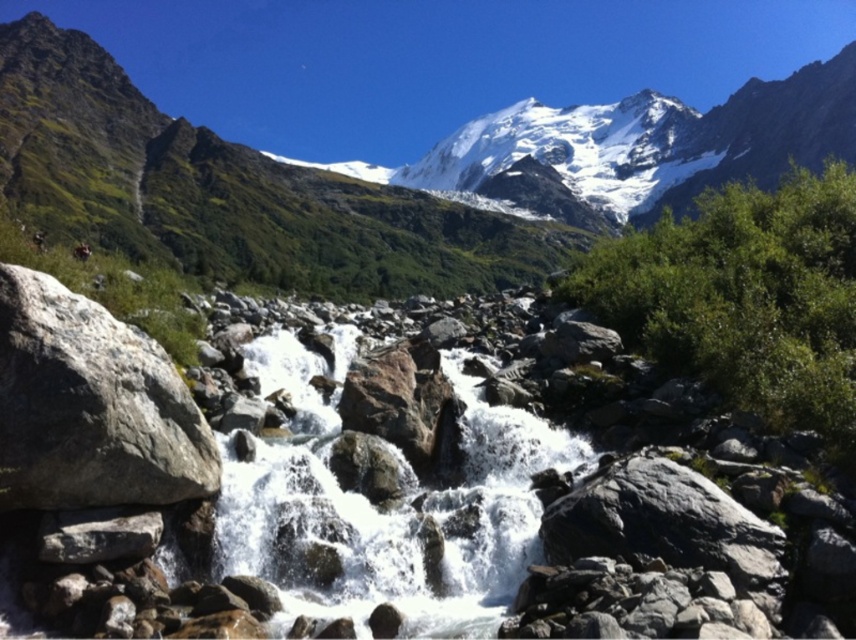
Question: Can you confirm if white snow-covered mountain at center is positioned to the right of gray rough rock at left?

Choices:
 (A) no
 (B) yes

Answer: (B)

Question: Which of the following is the farthest from the observer?

Choices:
 (A) white frothy water at center
 (B) gray rough rock at left

Answer: (B)

Question: Can you confirm if white snow-covered mountain at center is thinner than gray rough rock at left?

Choices:
 (A) no
 (B) yes

Answer: (A)

Question: Among these objects, which one is farthest from the camera?

Choices:
 (A) white frothy water at center
 (B) white snow-covered mountain at center
 (C) gray rough rock at left

Answer: (B)

Question: Which point is closer to the camera?

Choices:
 (A) gray rough rock at left
 (B) white snow-covered mountain at center
 (C) white frothy water at center

Answer: (C)

Question: Can you confirm if white frothy water at center is thinner than gray rough rock at left?

Choices:
 (A) no
 (B) yes

Answer: (A)